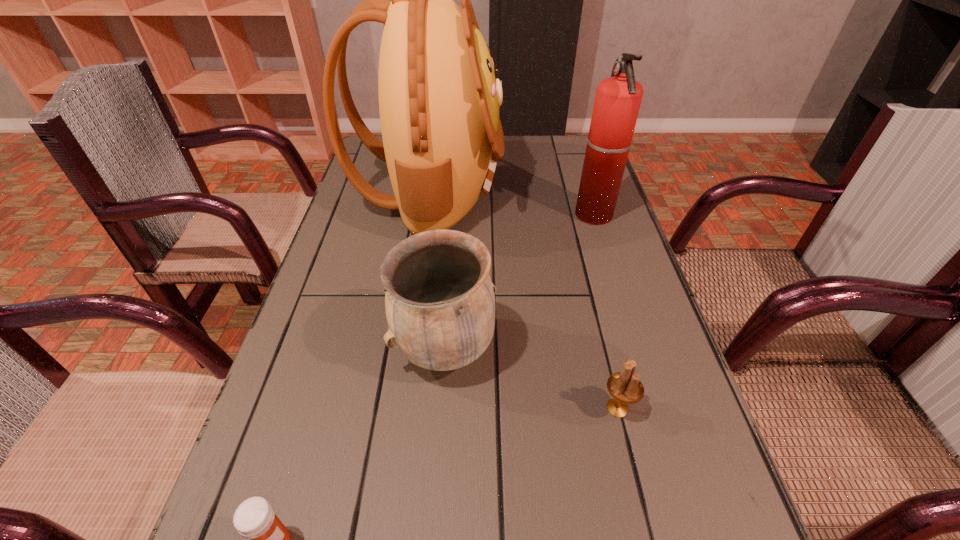
Image resolution: width=960 pixels, height=540 pixels. I want to click on free point located on the back of the third shortest object, so click(x=453, y=231).

Identify the location of vacant space located 0.160m on the back of the candle holder. This screenshot has width=960, height=540. (596, 322).

Identify the location of object that is at the far edge. (439, 97).

You are a GUI agent. You are given a task and a screenshot of the screen. Output one action in this format:
    pyautogui.click(x=<x>, y=<y>)
    Task: Click on the object present at the left edge
    
    Given the screenshot: What is the action you would take?
    pyautogui.click(x=439, y=97)

Locate an element on the screen. The width and height of the screenshot is (960, 540). fire extinguisher that is at the right edge is located at coordinates (617, 102).

Find the location of a particular element. The height and width of the screenshot is (540, 960). candle holder at the right edge is located at coordinates (625, 387).

This screenshot has height=540, width=960. I want to click on object located at the far left corner, so click(439, 97).

I want to click on blank space at the far edge, so click(517, 154).

In the image, there is a desktop. Identify the location of vacant space at the left edge. (387, 248).

I want to click on vacant area at the right edge of the desktop, so click(570, 262).